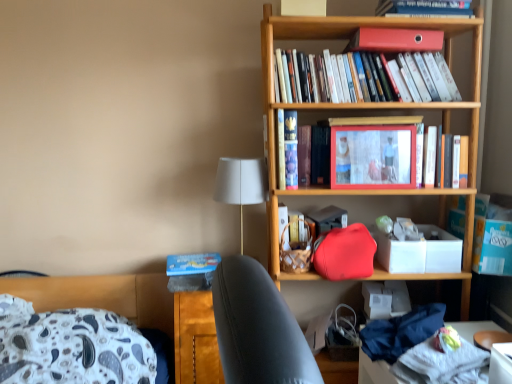
Question: From the image's perspective, is hardcover book at center, placed as the 3th book when sorted from top to bottom, located above or below matte plastic picture frame at center?

Choices:
 (A) below
 (B) above

Answer: (A)

Question: Is hardcover book at center, the first book in the bottom-to-top sequence, situated inside matte plastic picture frame at center or outside?

Choices:
 (A) inside
 (B) outside

Answer: (B)

Question: Which is farther from the matte plastic picture frame at center?

Choices:
 (A) hardcover book at center, which ranks as the second book in top-to-bottom order
 (B) white matte box at center-right
 (C) hardcover books at upper center, which is counted as the 1th book, starting from the top
 (D) white fabric at lower right
 (E) white fabric lampshade at center

Answer: (D)

Question: Estimate the real-world distances between objects in this image. Which object is closer to the hardcover book at center, which ranks as the second book in top-to-bottom order?

Choices:
 (A) blue matte paperback book at lower left, the 2th paperback book positioned from the top
 (B) matte plastic picture frame at center
 (C) white fabric lampshade at center
 (D) white matte box at center-right
 (E) hardcover book at center, placed as the 3th book when sorted from top to bottom

Answer: (C)